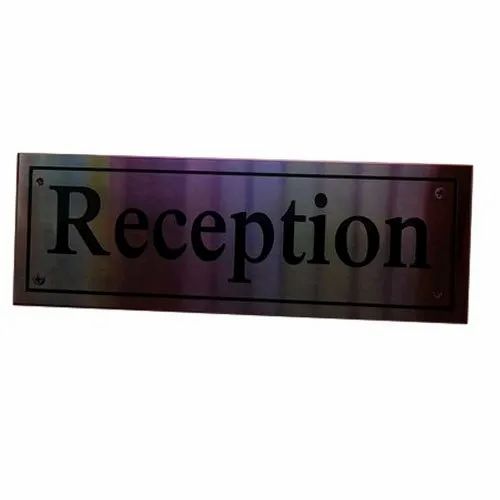
This screenshot has width=500, height=500. Find the location of `reception`. reception is located at coordinates (245, 214).